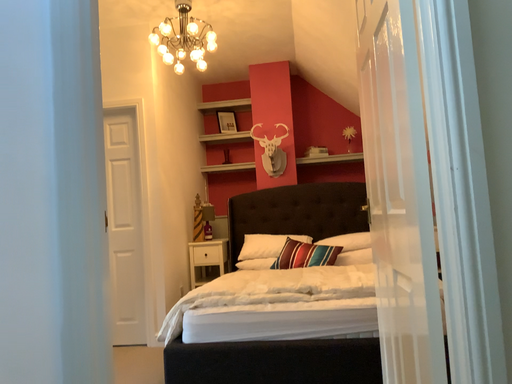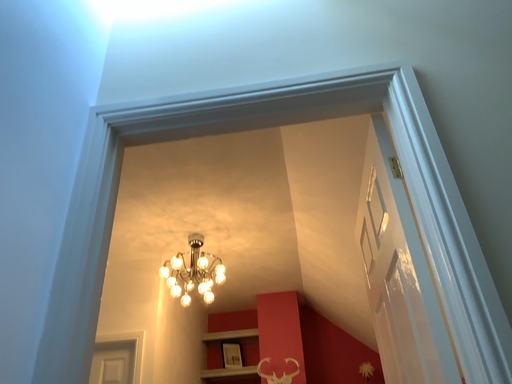
Question: Which way did the camera rotate in the video?

Choices:
 (A) rotated upward
 (B) rotated downward

Answer: (A)